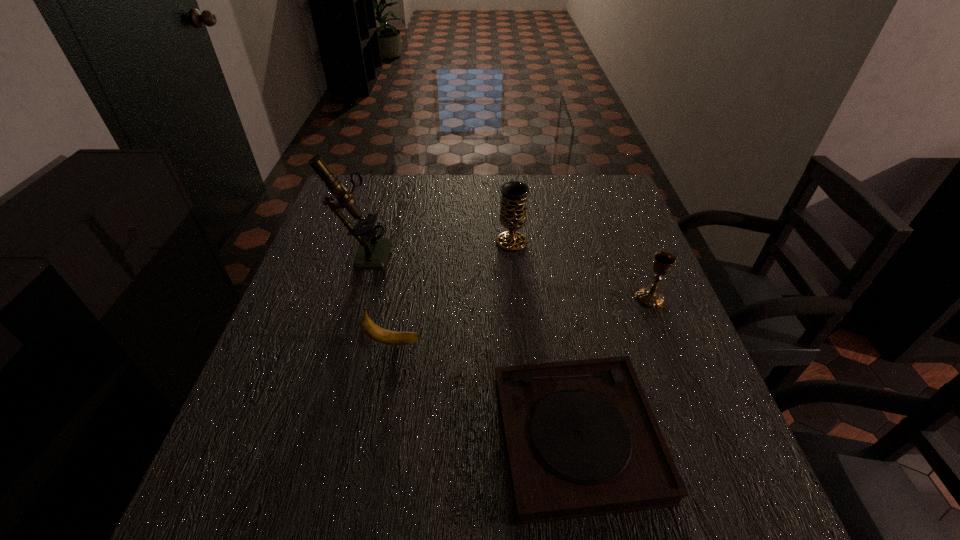
Locate an element on the screen. vacant space located on the front of the nearer chalice is located at coordinates (689, 400).

Image resolution: width=960 pixels, height=540 pixels. Identify the location of vacant region located 0.200m at the start of the peel on the fourth farthest object. (514, 343).

The height and width of the screenshot is (540, 960). Find the location of `free space located on the left of the shortest object`. free space located on the left of the shortest object is located at coordinates (420, 437).

At what (x,y) coordinates should I click in order to perform the action: click on object present at the near edge. Please return your answer as a coordinate pair (x, y). The height and width of the screenshot is (540, 960). Looking at the image, I should click on point(581,440).

Where is `object at the left edge`? Image resolution: width=960 pixels, height=540 pixels. object at the left edge is located at coordinates (373, 252).

Where is `chalice located at the right edge`? Image resolution: width=960 pixels, height=540 pixels. chalice located at the right edge is located at coordinates (649, 297).

The width and height of the screenshot is (960, 540). What are the coordinates of `phonograph record situated at the right edge` in the screenshot? It's located at (581, 440).

Where is `object located in the near right corner section of the desktop`? object located in the near right corner section of the desktop is located at coordinates (581, 440).

This screenshot has height=540, width=960. Identify the location of vacant region at the far edge of the desktop. (444, 188).

This screenshot has height=540, width=960. In the image, there is a desktop. What are the coordinates of `vacant space at the near edge` in the screenshot? It's located at (308, 521).